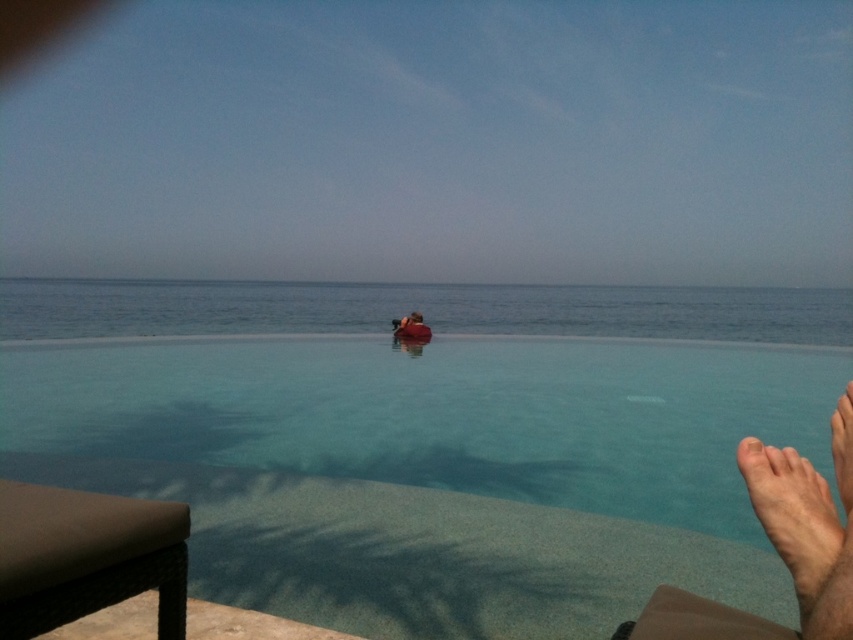
Can you confirm if clear blue water at center is positioned above skinny barefoot at lower right?

Indeed, clear blue water at center is positioned over skinny barefoot at lower right.

Is point (753, 337) farther from viewer compared to point (842, 634)?

Yes, it is behind point (842, 634).

You are a GUI agent. You are given a task and a screenshot of the screen. Output one action in this format:
    pyautogui.click(x=<x>, y=<y>)
    Task: Click on the clear blue water at center
    Image resolution: width=853 pixels, height=640 pixels.
    Given the screenshot: What is the action you would take?
    (419, 308)

Can you confirm if skinny barefoot at lower right is positioned to the left of dark brown leather chair at center?

Incorrect, skinny barefoot at lower right is not on the left side of dark brown leather chair at center.

Is skinny barefoot at lower right wider than dark brown leather chair at center?

No.

Locate an element on the screen. skinny barefoot at lower right is located at coordinates (805, 524).

Can you confirm if clear blue water at center is positioned to the left of dark brown leather chair at center?

No, clear blue water at center is not to the left of dark brown leather chair at center.

Can you confirm if clear blue water at center is thinner than dark brown leather chair at center?

In fact, clear blue water at center might be wider than dark brown leather chair at center.

Is point (369, 326) farther from camera compared to point (401, 321)?

Yes, it is.

At what (x,y) coordinates should I click in order to perform the action: click on clear blue water at center. Please return your answer as a coordinate pair (x, y). Looking at the image, I should click on (419, 308).